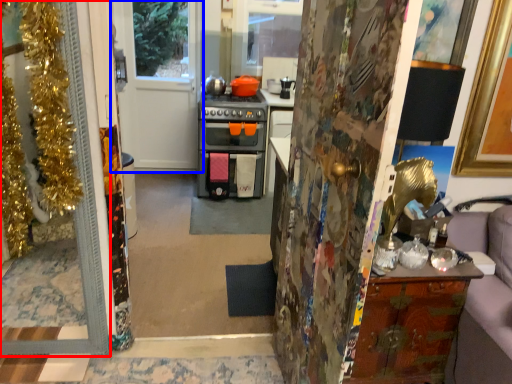
Question: Which of the following is the closest to the observer, door (highlighted by a red box) or door (highlighted by a blue box)?

Choices:
 (A) door
 (B) door

Answer: (A)